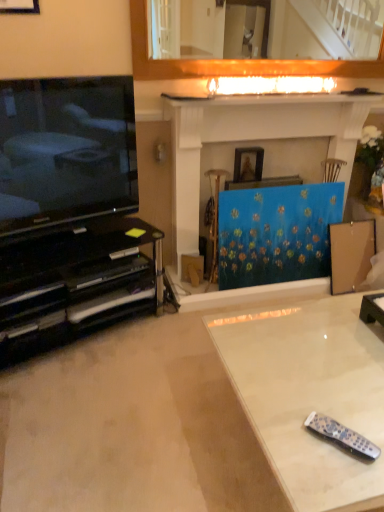
The width and height of the screenshot is (384, 512). In order to click on vacant area on top of white glossy table at lower right (from a real-world perspective) in this screenshot , I will do `click(317, 367)`.